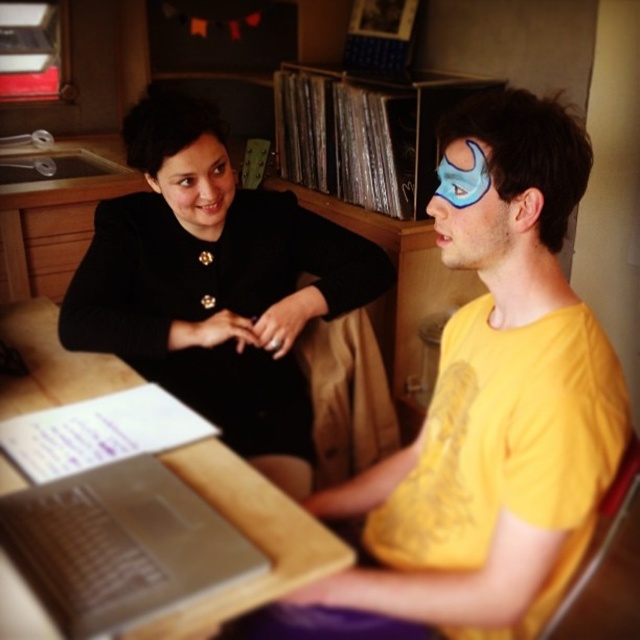
You are a delivery person who needs to place a 20 inch package between the black fabric dress at upper left and the silver metallic laptop at lower left. Can you fit the package between them?

The distance between the black fabric dress at upper left and the silver metallic laptop at lower left is 20.93 inches, so the 20 inch package can fit between them since it is slightly shorter than the available space.